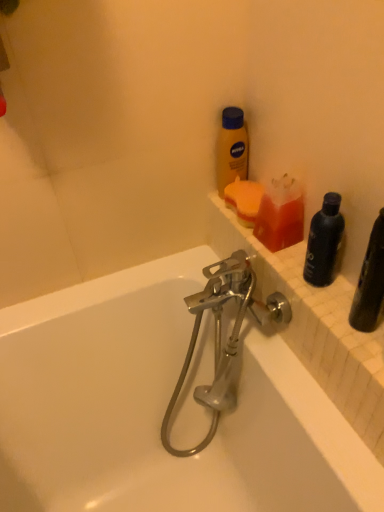
Question: From a real-world perspective, is chrome metallic faucet at center on top of translucent orange soap at upper right, the 2th cleaning product viewed from the back?

Choices:
 (A) no
 (B) yes

Answer: (A)

Question: Considering the relative sizes of chrome metallic faucet at center and translucent orange soap at upper right, the 2th cleaning product viewed from the back, in the image provided, is chrome metallic faucet at center bigger than translucent orange soap at upper right, the 2th cleaning product viewed from the back,?

Choices:
 (A) no
 (B) yes

Answer: (B)

Question: Does chrome metallic faucet at center turn towards translucent orange soap at upper right, placed as the 1th cleaning product when sorted from front to back?

Choices:
 (A) no
 (B) yes

Answer: (A)

Question: Considering the relative sizes of chrome metallic faucet at center and translucent orange soap at upper right, the 2th cleaning product viewed from the back, in the image provided, is chrome metallic faucet at center smaller than translucent orange soap at upper right, the 2th cleaning product viewed from the back,?

Choices:
 (A) yes
 (B) no

Answer: (B)

Question: Is chrome metallic faucet at center far away from translucent orange soap at upper right, the 2th cleaning product viewed from the back?

Choices:
 (A) no
 (B) yes

Answer: (A)

Question: Considering the relative positions of chrome metallic faucet at center and translucent orange soap at upper right, placed as the 1th cleaning product when sorted from front to back, in the image provided, is chrome metallic faucet at center behind translucent orange soap at upper right, placed as the 1th cleaning product when sorted from front to back,?

Choices:
 (A) no
 (B) yes

Answer: (A)

Question: Is translucent orange soap at upper right, the 2th cleaning product viewed from the back, wider than yellow matte lotion at upper center, the second bottle positioned from the bottom?

Choices:
 (A) no
 (B) yes

Answer: (B)

Question: Considering the relative positions of translucent orange soap at upper right, placed as the 1th cleaning product when sorted from front to back, and yellow matte lotion at upper center, which is the 2th bottle from right to left, in the image provided, is translucent orange soap at upper right, placed as the 1th cleaning product when sorted from front to back, to the right of yellow matte lotion at upper center, which is the 2th bottle from right to left, from the viewer's perspective?

Choices:
 (A) no
 (B) yes

Answer: (B)

Question: Does translucent orange soap at upper right, the 2th cleaning product viewed from the back, have a lesser width compared to yellow matte lotion at upper center, the second bottle positioned from the bottom?

Choices:
 (A) yes
 (B) no

Answer: (B)

Question: Would you say translucent orange soap at upper right, placed as the 1th cleaning product when sorted from front to back, contains yellow matte lotion at upper center, which is the 2th bottle from right to left?

Choices:
 (A) no
 (B) yes

Answer: (A)

Question: Is translucent orange soap at upper right, placed as the 1th cleaning product when sorted from front to back, facing away from yellow matte lotion at upper center, which is counted as the 1th bottle, starting from the back?

Choices:
 (A) no
 (B) yes

Answer: (A)

Question: Is the depth of translucent orange soap at upper right, the 2th cleaning product viewed from the back, less than that of yellow matte lotion at upper center, the first bottle positioned from the top?

Choices:
 (A) no
 (B) yes

Answer: (B)

Question: Is chrome metallic faucet at center closer to camera compared to black matte bottle at right, which is the 1th bottle from right to left?

Choices:
 (A) no
 (B) yes

Answer: (A)